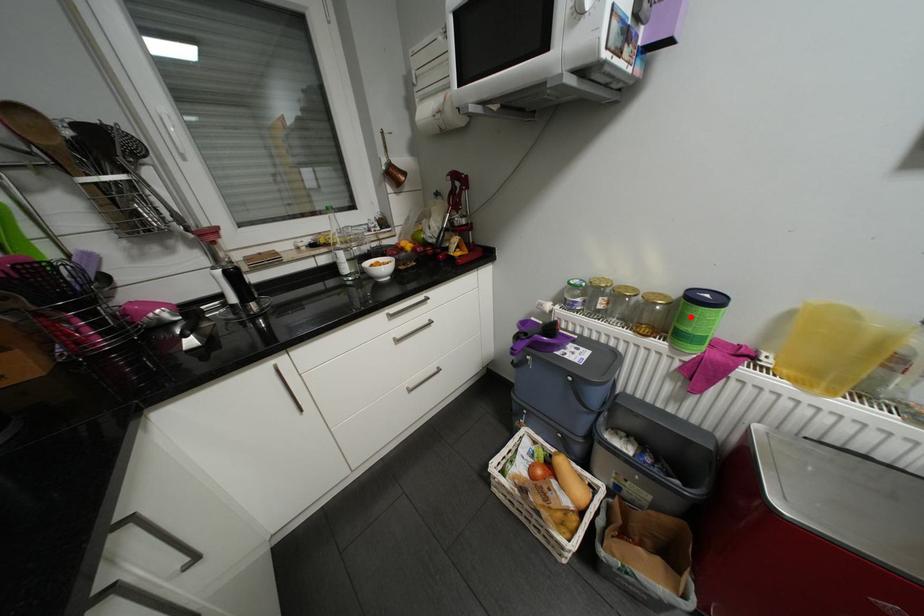
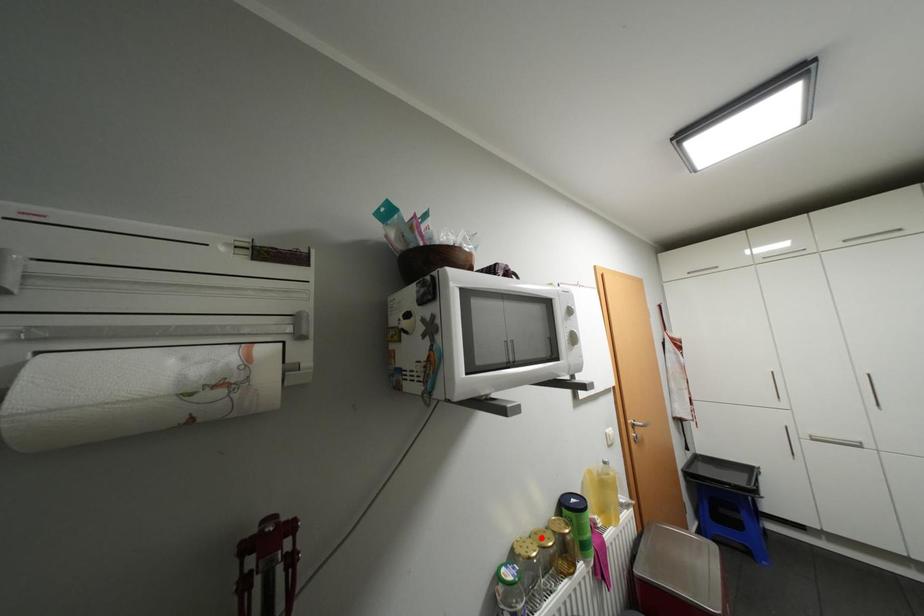
I am providing you with two images of the same scene from different viewpoints. A red point is marked on the first image and another point is marked on the second image. Is the red point in image1 aligned with the point shown in image2?

No